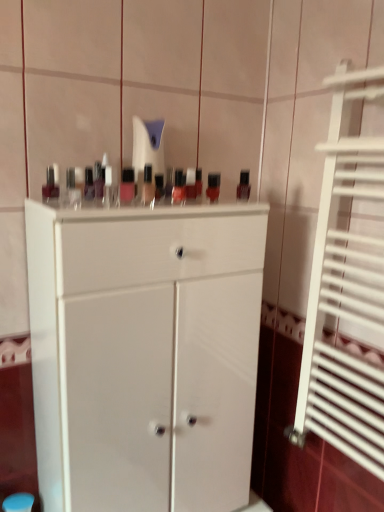
Question: Is the position of matte plastic nail polish bottles at center, the second toiletry viewed from the back, more distant than that of matte plastic mouthwash at center, which is counted as the second mouthwash, starting from the right?

Choices:
 (A) no
 (B) yes

Answer: (A)

Question: Is matte plastic nail polish bottles at center, the 1th toiletry positioned from the front, smaller than matte plastic mouthwash at center, the second mouthwash when ordered from left to right?

Choices:
 (A) yes
 (B) no

Answer: (B)

Question: Is matte plastic nail polish bottles at center, the second toiletry viewed from the back, surrounding matte plastic mouthwash at center, the second mouthwash when ordered from left to right?

Choices:
 (A) yes
 (B) no

Answer: (B)

Question: Are matte plastic nail polish bottles at center, the 1th toiletry positioned from the front, and matte plastic mouthwash at center, arranged as the 2th mouthwash when viewed from the back, making contact?

Choices:
 (A) no
 (B) yes

Answer: (A)

Question: Can you confirm if matte plastic nail polish bottles at center, the second toiletry viewed from the back, is shorter than matte plastic mouthwash at center, which is counted as the second mouthwash, starting from the right?

Choices:
 (A) no
 (B) yes

Answer: (B)

Question: Considering the positions of matte black bottle at left, marked as the first mouthwash in a left-to-right arrangement, and matte plastic nail polish bottles at center, the second toiletry viewed from the back, in the image, is matte black bottle at left, marked as the first mouthwash in a left-to-right arrangement, taller or shorter than matte plastic nail polish bottles at center, the second toiletry viewed from the back,?

Choices:
 (A) tall
 (B) short

Answer: (B)

Question: From the image's perspective, relative to matte plastic nail polish bottles at center, the second toiletry viewed from the back, is matte black bottle at left, which is the 3th mouthwash from back to front, above or below?

Choices:
 (A) below
 (B) above

Answer: (A)

Question: Which is correct: matte black bottle at left, which is the 3th mouthwash from back to front, is inside matte plastic nail polish bottles at center, the 1th toiletry positioned from the front, or outside of it?

Choices:
 (A) outside
 (B) inside

Answer: (A)

Question: Is matte black bottle at left, marked as the first mouthwash in a left-to-right arrangement, wider or thinner than matte plastic nail polish bottles at center, the 1th toiletry positioned from the front?

Choices:
 (A) wide
 (B) thin

Answer: (A)

Question: Relative to matte plastic nail polish bottles at center, the 1th toiletry positioned from the front, is matte plastic mouthwash at center, arranged as the 2th mouthwash when viewed from the back, in front or behind?

Choices:
 (A) behind
 (B) front

Answer: (A)

Question: From a real-world perspective, is matte plastic mouthwash at center, which is counted as the second mouthwash, starting from the right, physically located above or below matte plastic nail polish bottles at center, the 1th toiletry positioned from the front?

Choices:
 (A) above
 (B) below

Answer: (B)

Question: Is matte plastic mouthwash at center, arranged as the 2th mouthwash when viewed from the back, wider or thinner than matte plastic nail polish bottles at center, the second toiletry viewed from the back?

Choices:
 (A) wide
 (B) thin

Answer: (A)

Question: Considering the positions of matte plastic mouthwash at center, which is counted as the second mouthwash, starting from the right, and matte plastic nail polish bottles at center, the 1th toiletry positioned from the front, in the image, is matte plastic mouthwash at center, which is counted as the second mouthwash, starting from the right, taller or shorter than matte plastic nail polish bottles at center, the 1th toiletry positioned from the front,?

Choices:
 (A) tall
 (B) short

Answer: (A)

Question: Do you think matte black nail polish at upper left, arranged as the 2th toiletry when viewed from the front, is within matte black nail polish at upper center, which is counted as the third mouthwash, starting from the left, or outside of it?

Choices:
 (A) inside
 (B) outside

Answer: (B)

Question: Based on their sizes in the image, would you say matte black nail polish at upper left, arranged as the 1th toiletry when viewed from the back, is bigger or smaller than matte black nail polish at upper center, which is counted as the third mouthwash, starting from the left?

Choices:
 (A) small
 (B) big

Answer: (B)